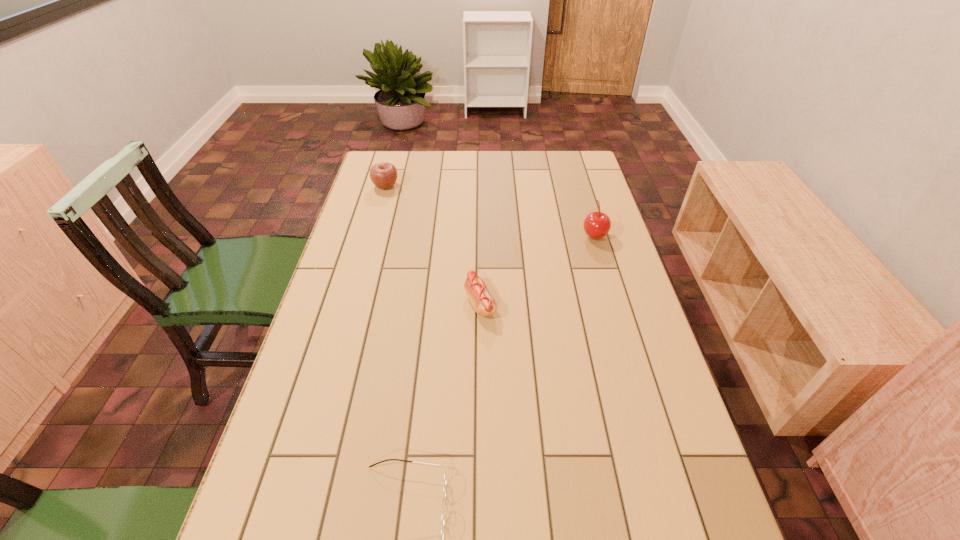
This screenshot has width=960, height=540. What are the coordinates of `empty space that is in between the second tallest object and the third nearest object` in the screenshot? It's located at (490, 211).

Locate an element on the screen. unoccupied position between the third farthest object and the apple is located at coordinates (433, 245).

The width and height of the screenshot is (960, 540). In order to click on object that is the second closest to the second tallest object in this screenshot , I will do `click(596, 225)`.

I want to click on object that ranks as the closest to the sausage, so click(596, 225).

Find the location of a particular element. This screenshot has height=540, width=960. free space that satisfies the following two spatial constraints: 1. on the side of the apple with the unique marking; 2. on the back side of the sausage is located at coordinates (352, 303).

The image size is (960, 540). In order to click on vacant space that satisfies the following two spatial constraints: 1. on the side of the leftmost object with the unique marking; 2. on the back side of the tallest object in this screenshot , I will do `click(372, 235)`.

Where is `blank space that satisfies the following two spatial constraints: 1. on the side of the third object from left to right with the unique marking; 2. on the right side of the leftmost object`? The image size is (960, 540). blank space that satisfies the following two spatial constraints: 1. on the side of the third object from left to right with the unique marking; 2. on the right side of the leftmost object is located at coordinates (352, 303).

The image size is (960, 540). I want to click on vacant point that satisfies the following two spatial constraints: 1. on the side of the second tallest object with the unique marking; 2. on the left side of the third object from left to right, so click(x=352, y=303).

Where is `vacant space that satisfies the following two spatial constraints: 1. on the side of the second tallest object with the unique marking; 2. on the left side of the cherry`? This screenshot has width=960, height=540. vacant space that satisfies the following two spatial constraints: 1. on the side of the second tallest object with the unique marking; 2. on the left side of the cherry is located at coordinates (372, 235).